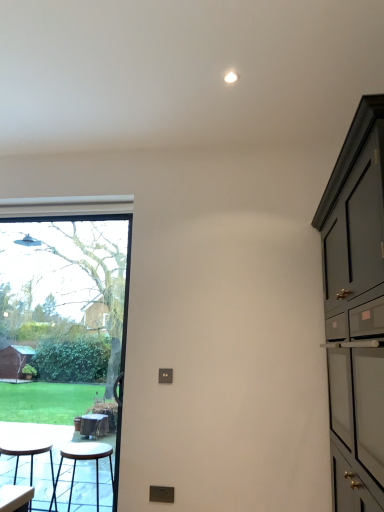
Question: Looking at their shapes, would you say transparent glass window at left is wider or thinner than matte dark green cabinet at right?

Choices:
 (A) wide
 (B) thin

Answer: (B)

Question: Considering the positions of point (72, 339) and point (337, 190), is point (72, 339) closer or farther from the camera than point (337, 190)?

Choices:
 (A) closer
 (B) farther

Answer: (B)

Question: Which object is the closest to the transparent glass window at left?

Choices:
 (A) matte dark green cabinet at right
 (B) matte black stool at lower left, which is the second stool from right to left
 (C) metallic stool at lower left, which is the 1th stool from right to left

Answer: (C)

Question: Which is nearer to the metallic stool at lower left, marked as the 2th stool in a left-to-right arrangement?

Choices:
 (A) transparent glass window at left
 (B) matte dark green cabinet at right
 (C) matte black stool at lower left, which is the second stool from right to left

Answer: (C)